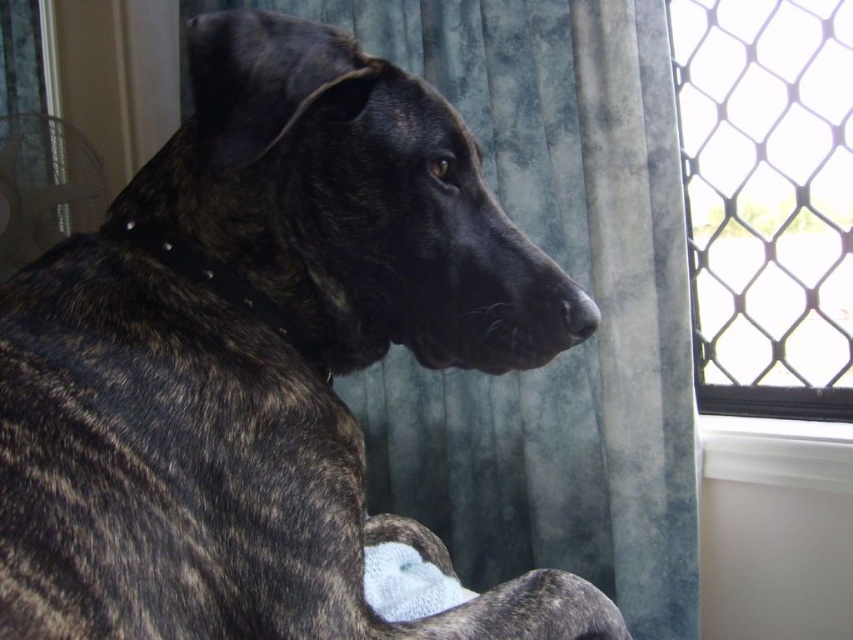
You need to hang a small picture frame that is 10 inches wide on the wall between the black mesh screen at upper right and the white plastic window sill at lower right. Is there enough space for the frame?

The distance between the black mesh screen at upper right and the white plastic window sill at lower right is 10.88 inches. Since the picture frame is 10 inches wide, there is enough space to hang it between them.

You are looking at the image of the dog and notice two points marked in the scene. Which of the two points, point (193, 157) or point (798, 340), is closer to you?

Point (193, 157) is closer to the viewer than point (798, 340).